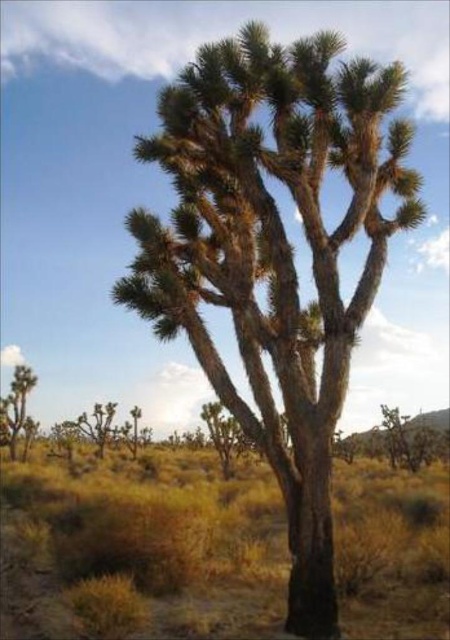
Does point (151, 627) come closer to viewer compared to point (10, 381)?

Yes, it is.

Who is taller, brown textured tree at center or green leafy bush at lower left?

With more height is green leafy bush at lower left.

Where is `brown textured tree at center`? The image size is (450, 640). brown textured tree at center is located at coordinates (142, 547).

You are a GUI agent. You are given a task and a screenshot of the screen. Output one action in this format:
    pyautogui.click(x=<x>, y=<y>)
    Task: Click on the brown textured tree at center
    
    Given the screenshot: What is the action you would take?
    (x=142, y=547)

Is greenish-brown bark tree at center to the right of green leafy bush at lower left from the viewer's perspective?

Yes, greenish-brown bark tree at center is to the right of green leafy bush at lower left.

Does greenish-brown bark tree at center have a greater width compared to green leafy bush at lower left?

In fact, greenish-brown bark tree at center might be narrower than green leafy bush at lower left.

Locate an element on the screen. greenish-brown bark tree at center is located at coordinates (274, 253).

Image resolution: width=450 pixels, height=640 pixels. In order to click on greenish-brown bark tree at center in this screenshot , I will do `click(274, 253)`.

Which is behind, point (229, 435) or point (17, 380)?

The point (17, 380) is behind.

Is point (215, 413) closer to camera compared to point (26, 390)?

Yes.

Between point (210, 432) and point (13, 458), which one is positioned behind?

The point (13, 458) is more distant.

This screenshot has width=450, height=640. What are the coordinates of `brown textured bark tree at center` in the screenshot? It's located at (225, 435).